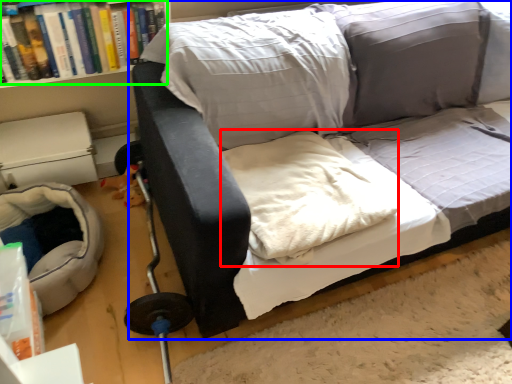
Question: Considering the real-world distances, which object is closest to linen (highlighted by a red box)? studio couch (highlighted by a blue box) or book (highlighted by a green box).

Choices:
 (A) studio couch
 (B) book

Answer: (A)